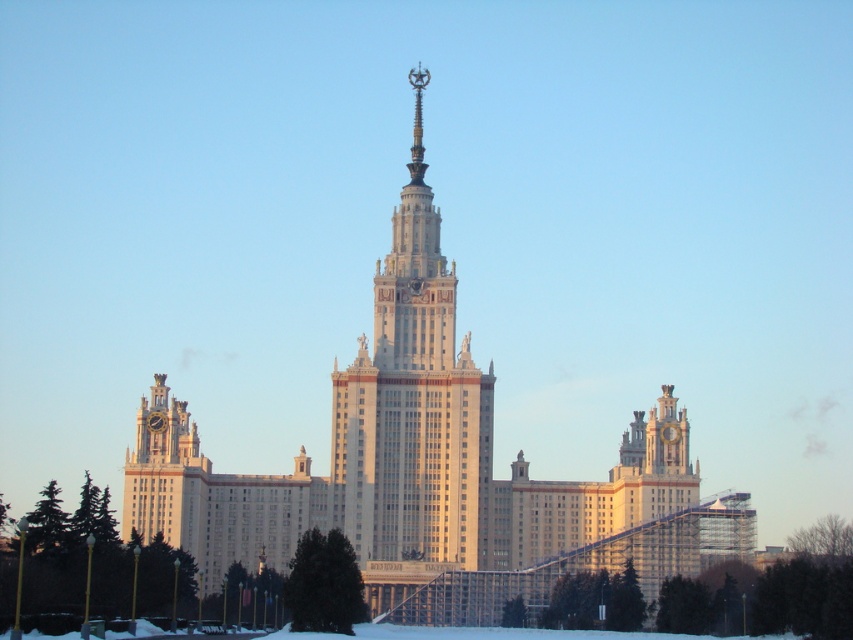
Does white stone building at center have a lesser height compared to white marble tower at center?

In fact, white stone building at center may be taller than white marble tower at center.

Is white stone building at center closer to the viewer compared to white marble tower at center?

That is False.

The width and height of the screenshot is (853, 640). I want to click on white stone building at center, so click(432, 470).

At what (x,y) coordinates should I click in order to perform the action: click on white stone building at center. Please return your answer as a coordinate pair (x, y). This screenshot has height=640, width=853. Looking at the image, I should click on (432, 470).